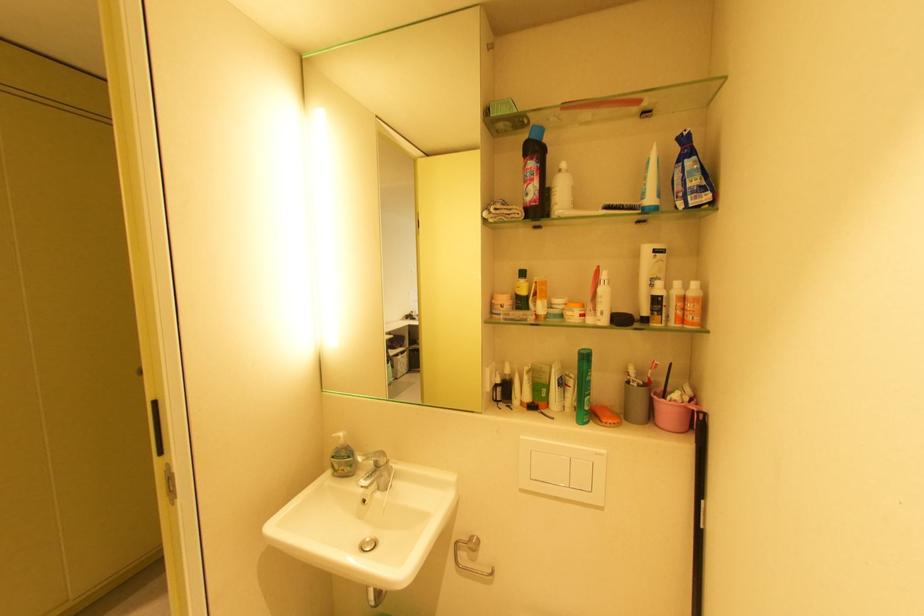
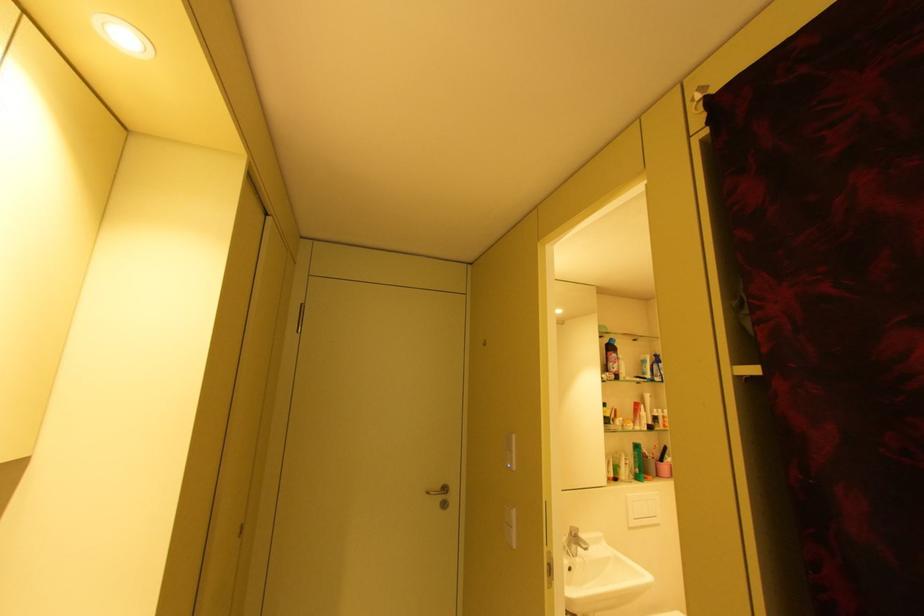
Find the pixel in the second image that matches pixel 500 215 in the first image.

(614, 377)